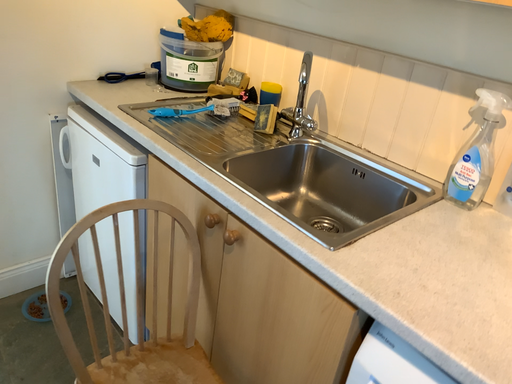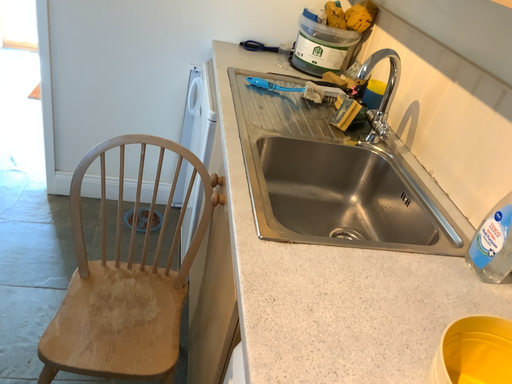
Question: Which way did the camera rotate in the video?

Choices:
 (A) rotated right
 (B) rotated left

Answer: (B)